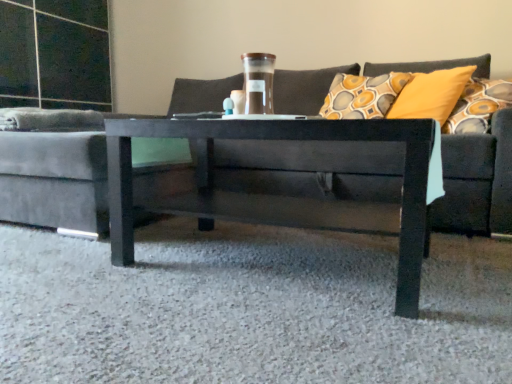
Question: Choose the correct answer: Is translucent glass jar at center inside dark gray fabric couch at center or outside it?

Choices:
 (A) outside
 (B) inside

Answer: (B)

Question: Considering the positions of translucent glass jar at center and dark gray fabric couch at center in the image, is translucent glass jar at center bigger or smaller than dark gray fabric couch at center?

Choices:
 (A) small
 (B) big

Answer: (A)

Question: Based on their relative distances, which object is farther from the glossy black coffee table at center?

Choices:
 (A) dark gray fabric couch at center
 (B) translucent glass jar at center

Answer: (A)

Question: Estimate the real-world distances between objects in this image. Which object is farther from the translucent glass jar at center?

Choices:
 (A) glossy black coffee table at center
 (B) dark gray fabric couch at center

Answer: (B)